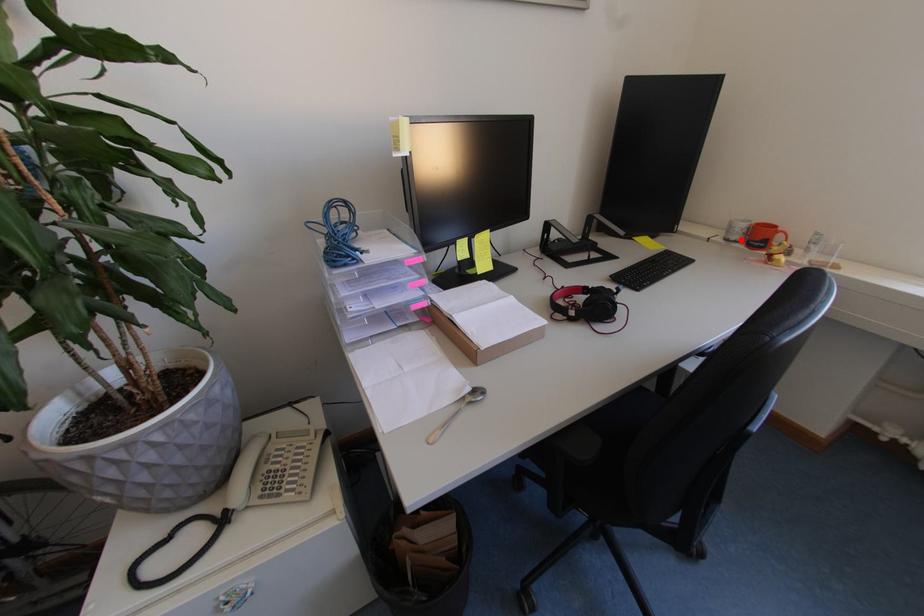
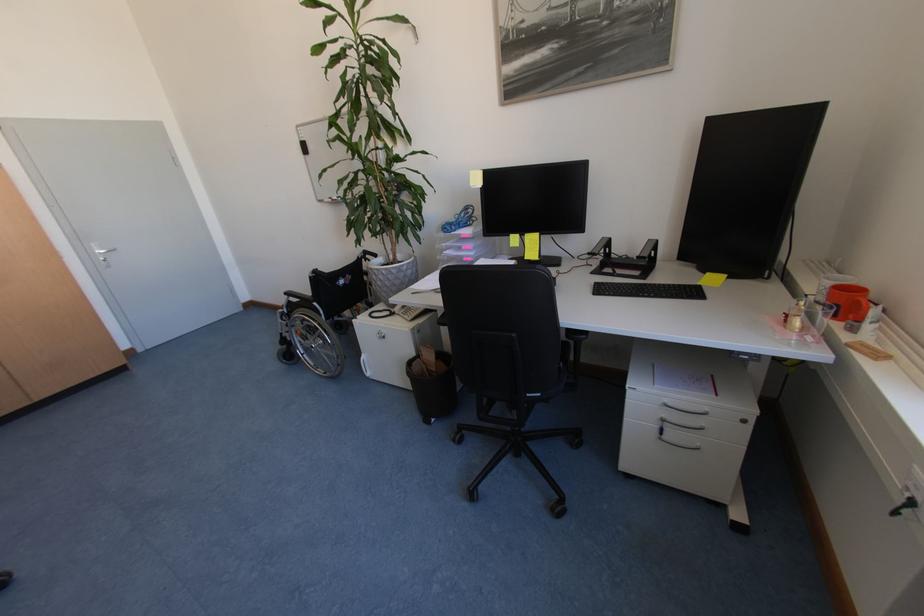
The point at the highlighted location is marked in the first image. Where is the corresponding point in the second image?

(824, 300)